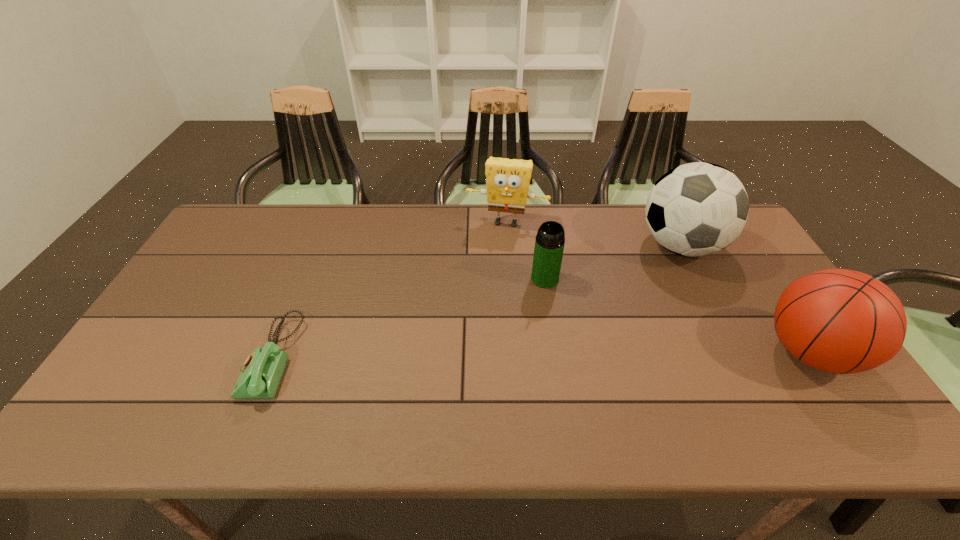
In the image, there is a desktop. At what (x,y) coordinates should I click in order to perform the action: click on free space at the right edge. Please return your answer as a coordinate pair (x, y). This screenshot has height=540, width=960. Looking at the image, I should click on (746, 313).

At what (x,y) coordinates should I click in order to perform the action: click on vacant area between the telephone and the thermos bottle. Please return your answer as a coordinate pair (x, y). Image resolution: width=960 pixels, height=540 pixels. Looking at the image, I should click on (409, 318).

Locate an element on the screen. The height and width of the screenshot is (540, 960). free space between the thermos bottle and the shortest object is located at coordinates (x=409, y=318).

Identify the location of free space between the basketball and the thermos bottle. Image resolution: width=960 pixels, height=540 pixels. (677, 315).

The image size is (960, 540). What are the coordinates of `blank region between the soccer ball and the basketball` in the screenshot? It's located at (745, 299).

You are a GUI agent. You are given a task and a screenshot of the screen. Output one action in this format:
    pyautogui.click(x=<x>, y=<y>)
    Task: Click on the free space between the basketball and the telephone
    
    Given the screenshot: What is the action you would take?
    pyautogui.click(x=541, y=355)

Find the location of a particular element. The height and width of the screenshot is (540, 960). vacant area that lies between the soccer ball and the telephone is located at coordinates (477, 302).

What are the coordinates of `empty space that is in between the basketball and the sponge` in the screenshot? It's located at (658, 287).

You are a GUI agent. You are given a task and a screenshot of the screen. Output one action in this format:
    pyautogui.click(x=<x>, y=<y>)
    Task: Click on the free space between the sponge and the soccer ball
    This screenshot has height=540, width=960.
    Given the screenshot: What is the action you would take?
    pyautogui.click(x=593, y=234)

Find the location of a particular element. The height and width of the screenshot is (540, 960). free spot between the soccer ball and the leftmost object is located at coordinates (477, 302).